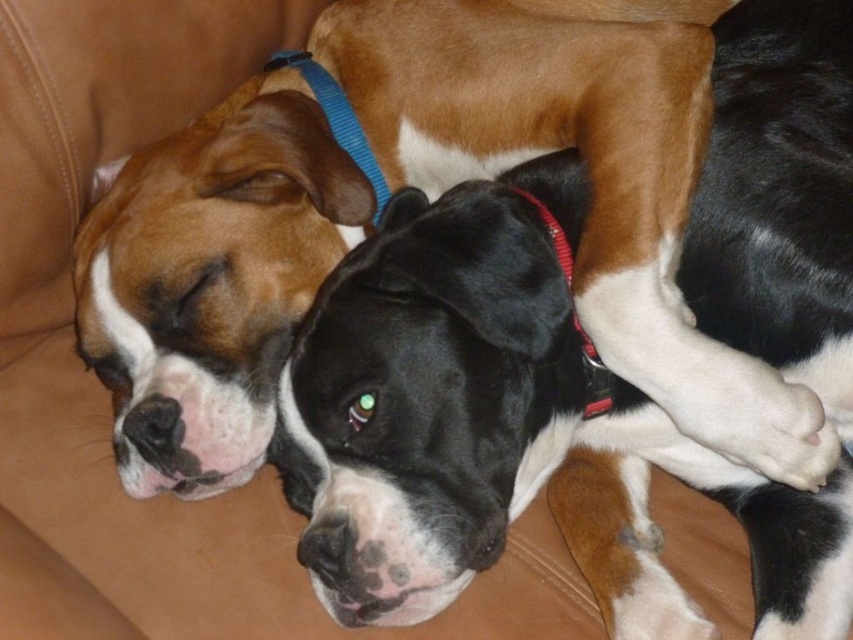
What do you see at coordinates (492, 417) in the screenshot? This screenshot has width=853, height=640. I see `black glossy dog at center` at bounding box center [492, 417].

Does black glossy dog at center have a larger size compared to red fabric collar at center?

Correct, black glossy dog at center is larger in size than red fabric collar at center.

The width and height of the screenshot is (853, 640). Identify the location of black glossy dog at center. (492, 417).

Is blue fabric neckband at upper center positioned at the back of red fabric collar at center?

Yes.

Which is behind, point (379, 168) or point (555, 227)?

The point (379, 168) is behind.

The height and width of the screenshot is (640, 853). In order to click on blue fabric neckband at upper center in this screenshot , I will do `click(337, 120)`.

At what (x,y) coordinates should I click in order to perform the action: click on blue fabric neckband at upper center. Please return your answer as a coordinate pair (x, y). The height and width of the screenshot is (640, 853). Looking at the image, I should click on (337, 120).

Does matte black dog at center appear on the right side of blue fabric neckband at upper center?

Yes, matte black dog at center is to the right of blue fabric neckband at upper center.

Locate an element on the screen. matte black dog at center is located at coordinates (212, 280).

Which is behind, point (659, 28) or point (294, 65)?

The point (294, 65) is more distant.

Image resolution: width=853 pixels, height=640 pixels. Identify the location of matte black dog at center. (212, 280).